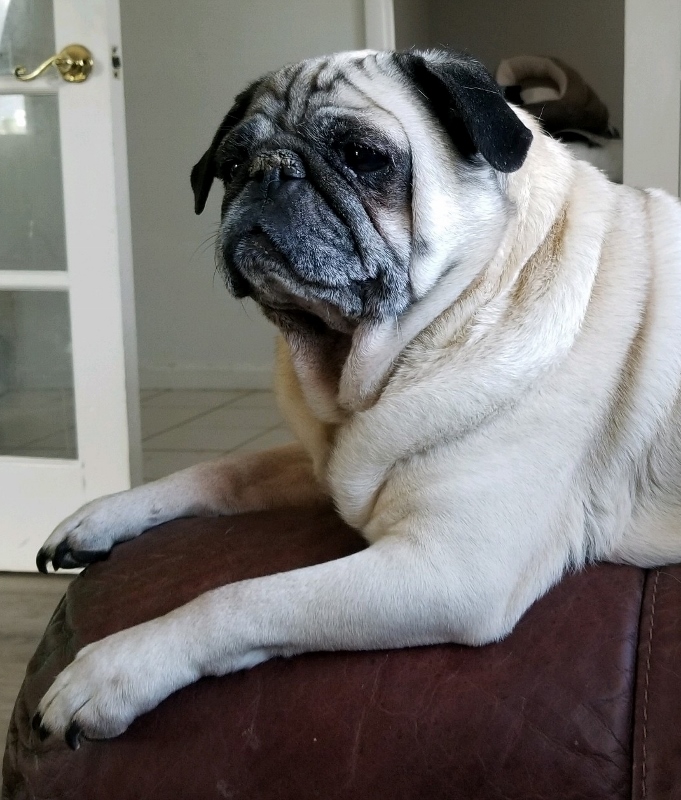
The image size is (681, 800). I want to click on cushion, so click(490, 717).